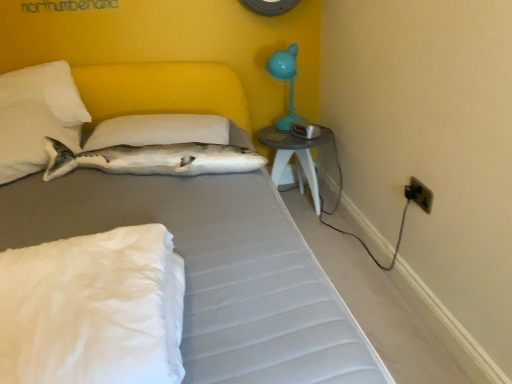
Question: Is white plush fish at upper left behind white soft pillow at upper center, which ranks as the 3th pillow in front-to-back order?

Choices:
 (A) yes
 (B) no

Answer: (B)

Question: Can we say white plush fish at upper left lies outside white soft pillow at upper center, which is counted as the 1th pillow, starting from the back?

Choices:
 (A) no
 (B) yes

Answer: (B)

Question: From the image's perspective, would you say white plush fish at upper left is shown under white soft pillow at upper center, which is counted as the 1th pillow, starting from the back?

Choices:
 (A) yes
 (B) no

Answer: (A)

Question: Does white plush fish at upper left have a smaller size compared to white soft pillow at upper center, which ranks as the 3th pillow in front-to-back order?

Choices:
 (A) yes
 (B) no

Answer: (B)

Question: Is white plush fish at upper left taller than white soft pillow at upper center, which is counted as the 1th pillow, starting from the back?

Choices:
 (A) no
 (B) yes

Answer: (B)

Question: Considering the positions of point (423, 190) and point (231, 274), is point (423, 190) closer or farther from the camera than point (231, 274)?

Choices:
 (A) closer
 (B) farther

Answer: (B)

Question: From a real-world perspective, relative to gray fabric bed at center, is black plastic electrical outlet at lower right vertically above or below?

Choices:
 (A) below
 (B) above

Answer: (B)

Question: In terms of width, does black plastic electrical outlet at lower right look wider or thinner when compared to gray fabric bed at center?

Choices:
 (A) thin
 (B) wide

Answer: (A)

Question: Looking at the image, does black plastic electrical outlet at lower right seem bigger or smaller compared to gray fabric bed at center?

Choices:
 (A) big
 (B) small

Answer: (B)

Question: Is white plush fish at upper left spatially inside teal plastic table lamp at upper right, or outside of it?

Choices:
 (A) inside
 (B) outside

Answer: (B)

Question: Considering the positions of point (166, 157) and point (276, 61), is point (166, 157) closer or farther from the camera than point (276, 61)?

Choices:
 (A) closer
 (B) farther

Answer: (A)

Question: Considering their positions, is white plush fish at upper left located in front of or behind teal plastic table lamp at upper right?

Choices:
 (A) behind
 (B) front

Answer: (B)

Question: In terms of height, does white plush fish at upper left look taller or shorter compared to teal plastic table lamp at upper right?

Choices:
 (A) tall
 (B) short

Answer: (B)

Question: From the image's perspective, is matte gray table at right positioned above or below white soft pillow at upper left, which ranks as the 2th pillow in back-to-front order?

Choices:
 (A) above
 (B) below

Answer: (B)

Question: In terms of height, does matte gray table at right look taller or shorter compared to white soft pillow at upper left, which ranks as the second pillow in front-to-back order?

Choices:
 (A) short
 (B) tall

Answer: (A)